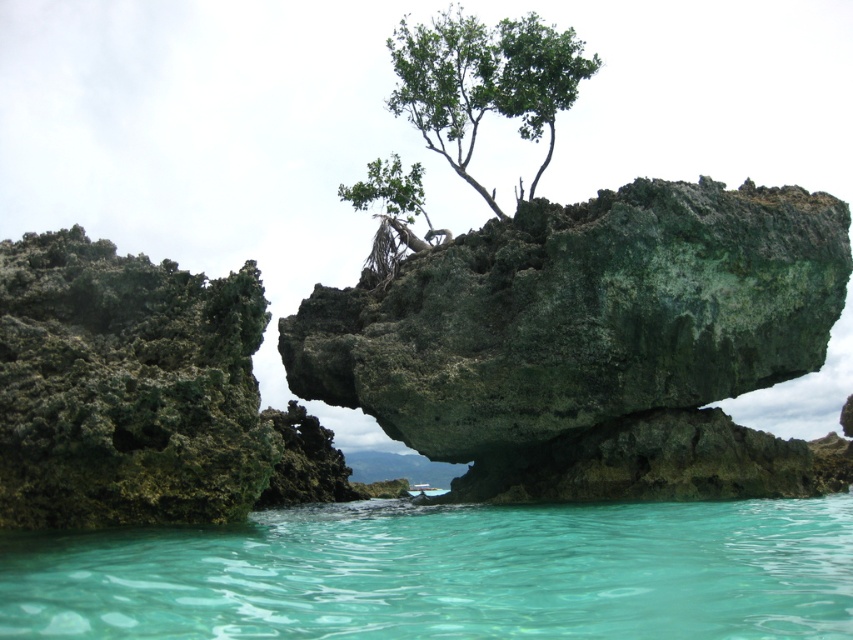
From the picture: Can you confirm if green mossy rock at center is positioned above green leafy tree at upper center?

Actually, green mossy rock at center is below green leafy tree at upper center.

Which is above, green mossy rock at center or green leafy tree at upper center?

green leafy tree at upper center is higher up.

Between point (302, 356) and point (463, 118), which one is positioned in front?

Point (302, 356) is in front.

The image size is (853, 640). What are the coordinates of `green mossy rock at center` in the screenshot? It's located at (592, 342).

Between clear water at lower center and green leafy tree at upper center, which one appears on the left side from the viewer's perspective?

From the viewer's perspective, green leafy tree at upper center appears more on the left side.

Does point (589, 563) come in front of point (415, 180)?

Yes, it is.

Who is more forward, (619, 568) or (372, 163)?

Positioned in front is point (619, 568).

Identify the location of clear water at lower center. This screenshot has width=853, height=640. (447, 573).

Between point (460, 362) and point (45, 436), which one is positioned behind?

Point (460, 362)

Between green mossy rock at center and green mossy rock at left, which one is positioned lower?

green mossy rock at left

At what (x,y) coordinates should I click in order to perform the action: click on green mossy rock at center. Please return your answer as a coordinate pair (x, y). Looking at the image, I should click on pyautogui.click(x=592, y=342).